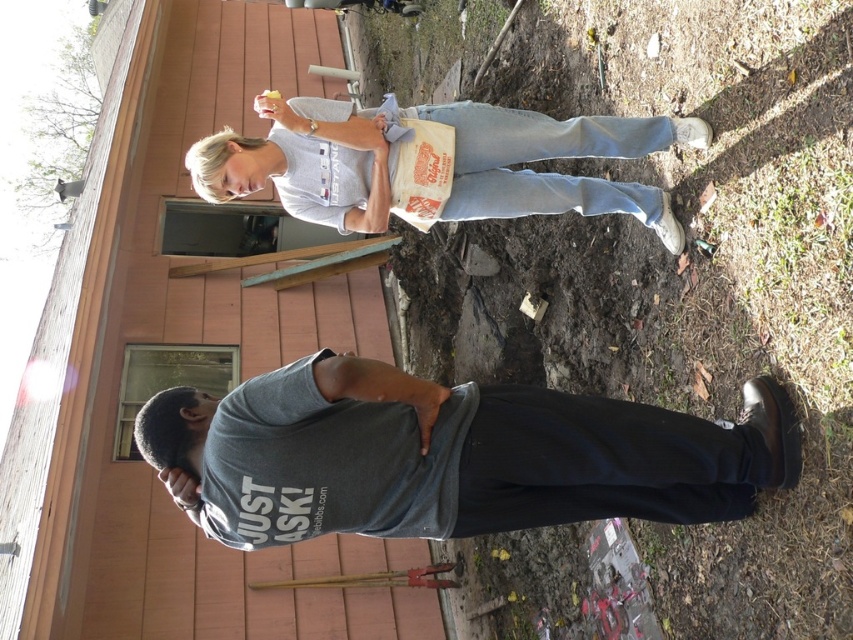
Can you confirm if dark gray t-shirt at center is taller than green leafy tree at upper left?

Incorrect, dark gray t-shirt at center's height is not larger of green leafy tree at upper left's.

What do you see at coordinates (450, 456) in the screenshot? I see `dark gray t-shirt at center` at bounding box center [450, 456].

What do you see at coordinates (450, 456) in the screenshot? I see `dark gray t-shirt at center` at bounding box center [450, 456].

Where is `dark gray t-shirt at center`? The width and height of the screenshot is (853, 640). dark gray t-shirt at center is located at coordinates (450, 456).

Between white paper bag at upper center and green leafy tree at upper left, which one is positioned lower?

Positioned lower is white paper bag at upper center.

Measure the distance between point (500, 200) and camera.

The distance of point (500, 200) from camera is 5.45 meters.

Find the location of a particular element. The width and height of the screenshot is (853, 640). white paper bag at upper center is located at coordinates (434, 163).

Does dark gray t-shirt at center have a lesser width compared to white paper bag at upper center?

No.

Who is more distant from viewer, (225, 481) or (378, 193)?

The point (378, 193) is behind.

Where is `dark gray t-shirt at center`? The height and width of the screenshot is (640, 853). dark gray t-shirt at center is located at coordinates (450, 456).

Where is `dark gray t-shirt at center`? dark gray t-shirt at center is located at coordinates (450, 456).